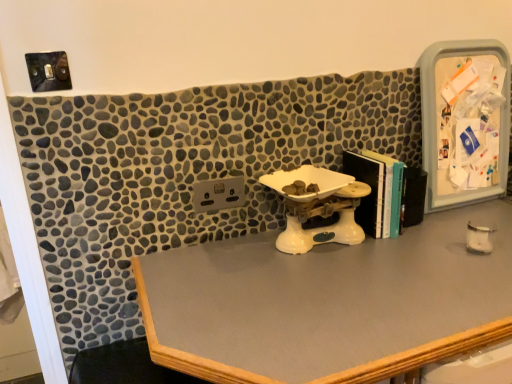
You are a GUI agent. You are given a task and a screenshot of the screen. Output one action in this format:
    pyautogui.click(x=<x>, y=<y>)
    Task: Click on the vacant space that is to the left of white plastic scale at center
    
    Given the screenshot: What is the action you would take?
    pyautogui.click(x=224, y=261)